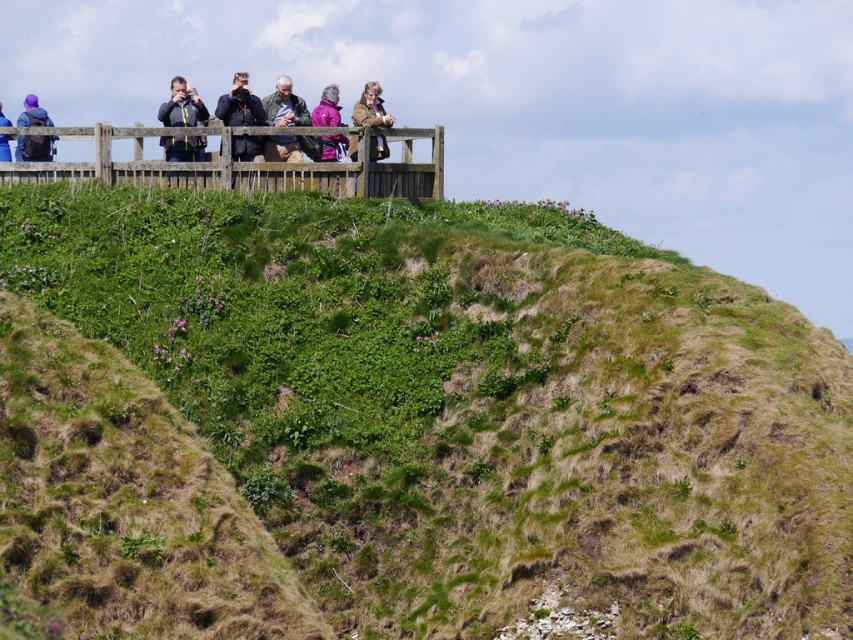
You are standing on the wooden platform and want to take a photo that includes both the green grassy hillside at lower left and the matte blue jacket at upper left. Which object should you frame first in your camera to ensure both are fully visible?

You should frame the matte blue jacket at upper left first because it has a greater width than the green grassy hillside at lower left, so capturing it first ensures there is enough space for both in the photo.

You are standing on the wooden platform and want to take a photo of the pink fabric jacket at upper center and the green grassy hillside at lower left. Which object should you frame first in your camera viewfinder to ensure both are in the shot?

You should frame the pink fabric jacket at upper center first because the green grassy hillside at lower left is to the left of it, so positioning the jacket first will allow the hillside to naturally fall into the frame on its left side.